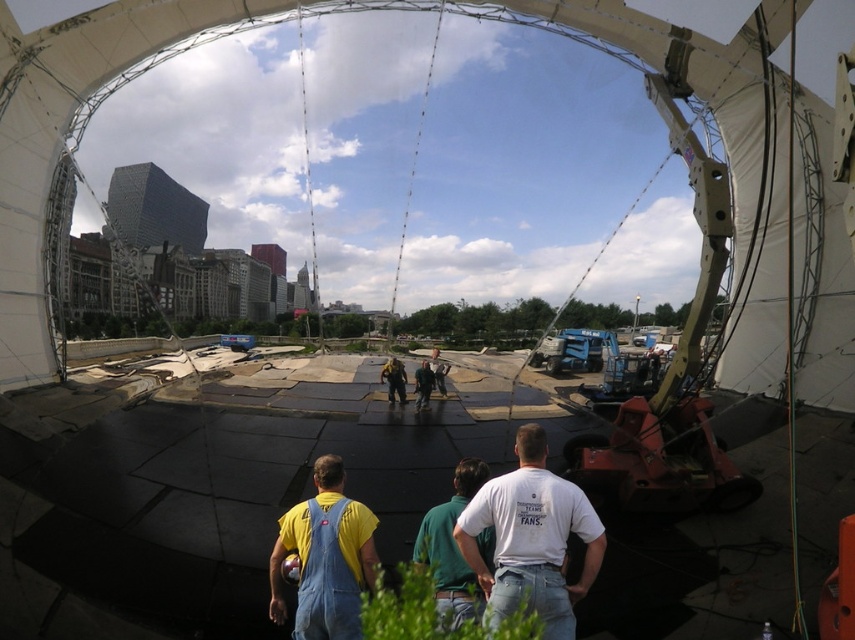
Can you confirm if white cotton t-shirt at center is positioned above yellow fabric worker at center?

No.

Between point (500, 493) and point (399, 384), which one is positioned in front?

Point (500, 493) is more forward.

The width and height of the screenshot is (855, 640). Find the location of `white cotton t-shirt at center`. white cotton t-shirt at center is located at coordinates (531, 538).

Is point (696, 579) closer to viewer compared to point (464, 593)?

No, (696, 579) is further to viewer.

Which is below, dark gray concrete at center or green cotton shirt at center?

dark gray concrete at center is below.

Is point (284, 404) positioned after point (449, 550)?

Yes.

This screenshot has width=855, height=640. What are the coordinates of `dark gray concrete at center` in the screenshot? It's located at (198, 499).

Is yellow fabric worker at center positioned at the back of dark green fabric pants at center?

Yes.

Is point (385, 372) more distant than point (431, 372)?

That is False.

The width and height of the screenshot is (855, 640). Find the location of `yellow fabric worker at center`. yellow fabric worker at center is located at coordinates (394, 380).